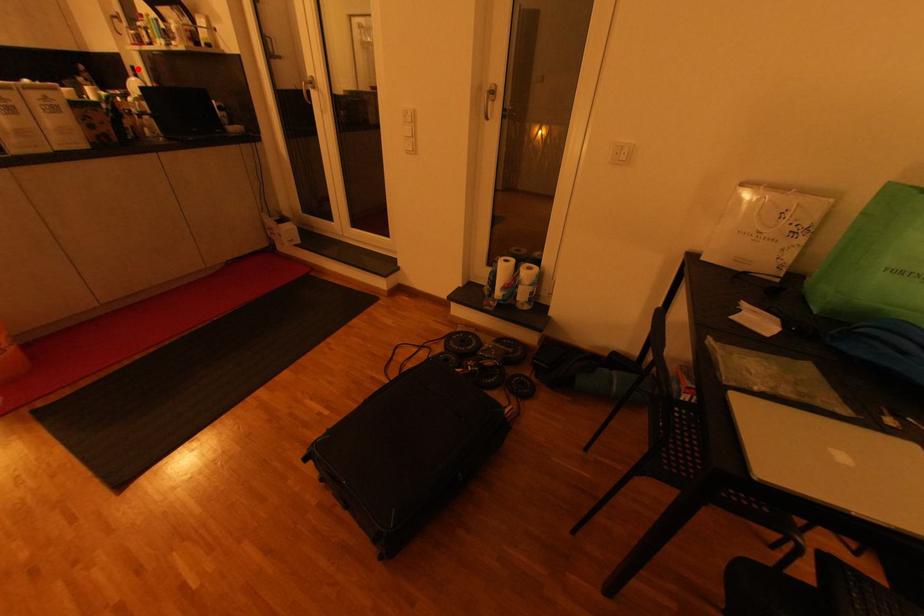
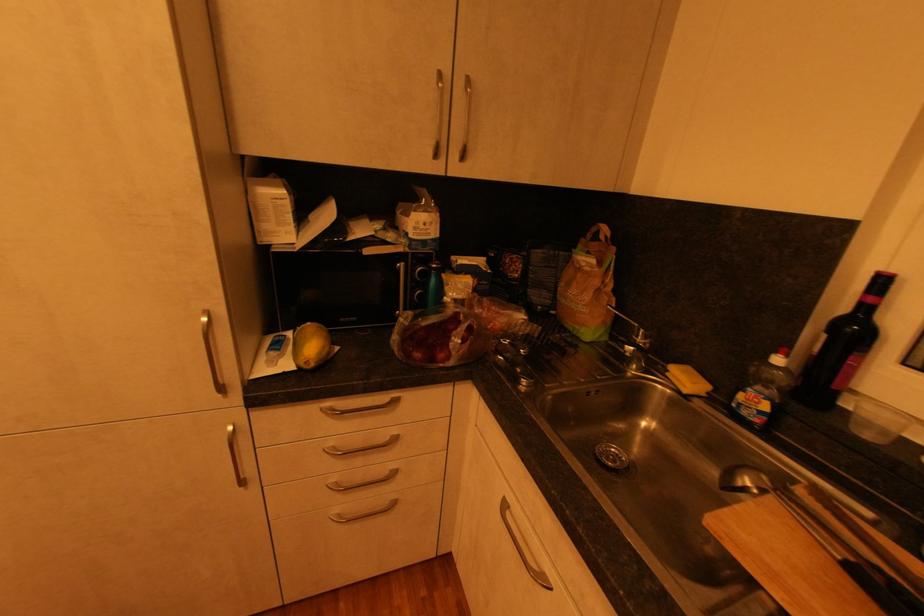
Question: A red point is marked in image1. In image2, is the corresponding 3D point closer to the camera or farther? Reply with the corresponding letter.

Choices:
 (A) The corresponding 3D point is closer.
 (B) The corresponding 3D point is farther.

Answer: (A)